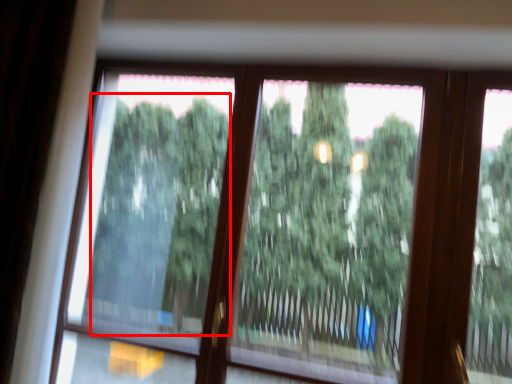
Question: From the image's perspective, what is the correct spatial relationship of tree (annotated by the red box) in relation to tree?

Choices:
 (A) below
 (B) above

Answer: (B)